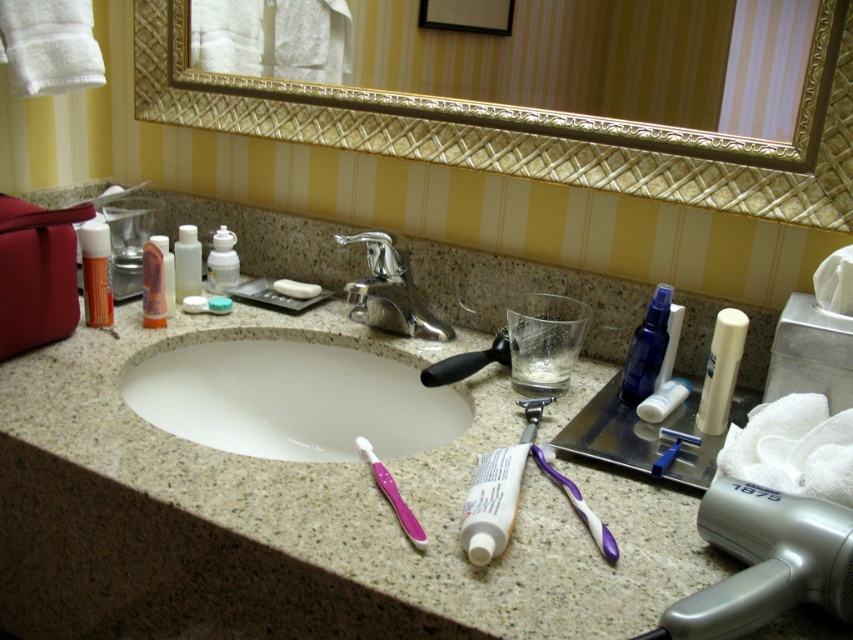
Question: Is purple plastic toothbrush at center further to camera compared to translucent plastic soap dispenser at center?

Choices:
 (A) yes
 (B) no

Answer: (B)

Question: Which object is positioned closest to the purple plastic toothbrush at center?

Choices:
 (A) white matte toothpaste at center
 (B) translucent plastic soap dispenser at center
 (C) translucent plastic bottle at left
 (D) white matte bar of soap at center

Answer: (A)

Question: Does blue glossy spray bottle at upper right appear on the right side of white matte tube of toothpaste at right?

Choices:
 (A) yes
 (B) no

Answer: (B)

Question: Can you confirm if polished chrome faucet at center is bigger than translucent plastic bottle at left?

Choices:
 (A) no
 (B) yes

Answer: (B)

Question: Among these objects, which one is nearest to the camera?

Choices:
 (A) gold textured mirror at upper center
 (B) white glossy sink at center
 (C) white matte bar of soap at center
 (D) translucent plastic bottles at center

Answer: (A)

Question: Which of the following is the farthest from the observer?

Choices:
 (A) (697, 524)
 (B) (306, 284)

Answer: (B)